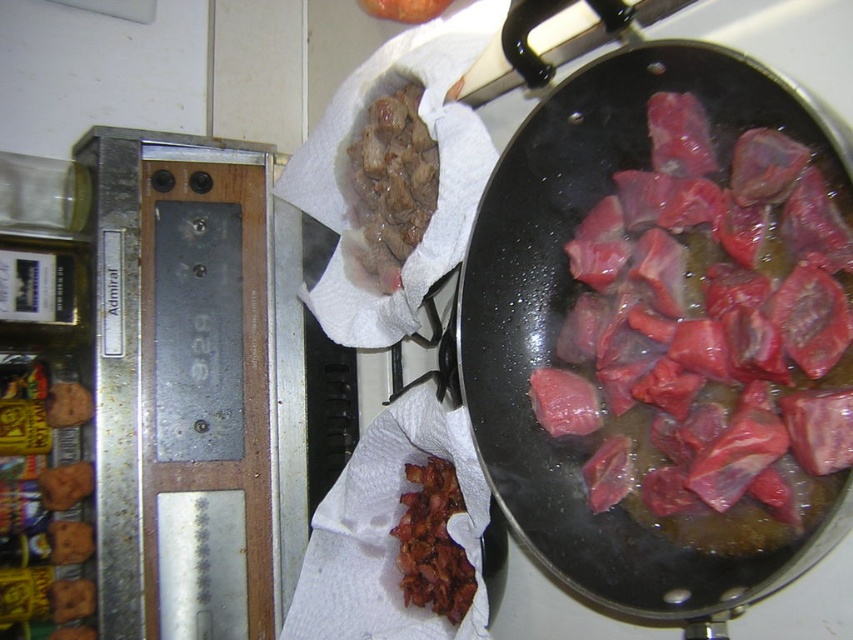
Consider the image. Which is more to the left, shiny black wok at center or slightly crispy bacon at center?

Positioned to the left is slightly crispy bacon at center.

Is shiny black wok at center wider than slightly crispy bacon at center?

Indeed, shiny black wok at center has a greater width compared to slightly crispy bacon at center.

Identify the location of shiny black wok at center. The height and width of the screenshot is (640, 853). (784, 45).